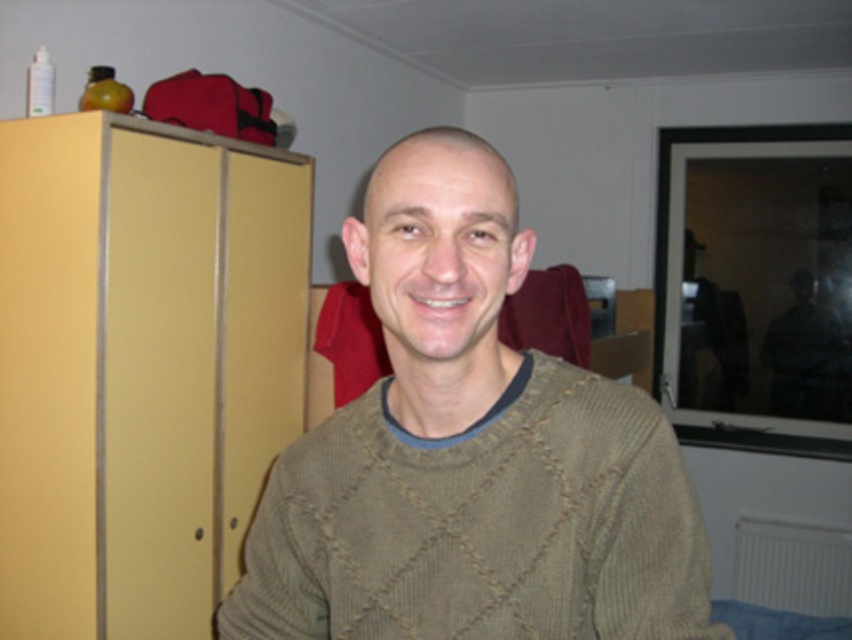
Question: Considering the relative positions of knitted olive sweater at center and matte yellow cabinet at left in the image provided, where is knitted olive sweater at center located with respect to matte yellow cabinet at left?

Choices:
 (A) above
 (B) below

Answer: (B)

Question: Which point is farther from the camera taking this photo?

Choices:
 (A) (634, 387)
 (B) (194, 467)

Answer: (B)

Question: Does knitted olive sweater at center have a lesser width compared to matte yellow cabinet at left?

Choices:
 (A) yes
 (B) no

Answer: (A)

Question: Is knitted olive sweater at center further to the viewer compared to matte yellow cabinet at left?

Choices:
 (A) yes
 (B) no

Answer: (B)

Question: Which object is closer to the camera taking this photo?

Choices:
 (A) knitted olive sweater at center
 (B) matte yellow cabinet at left

Answer: (A)